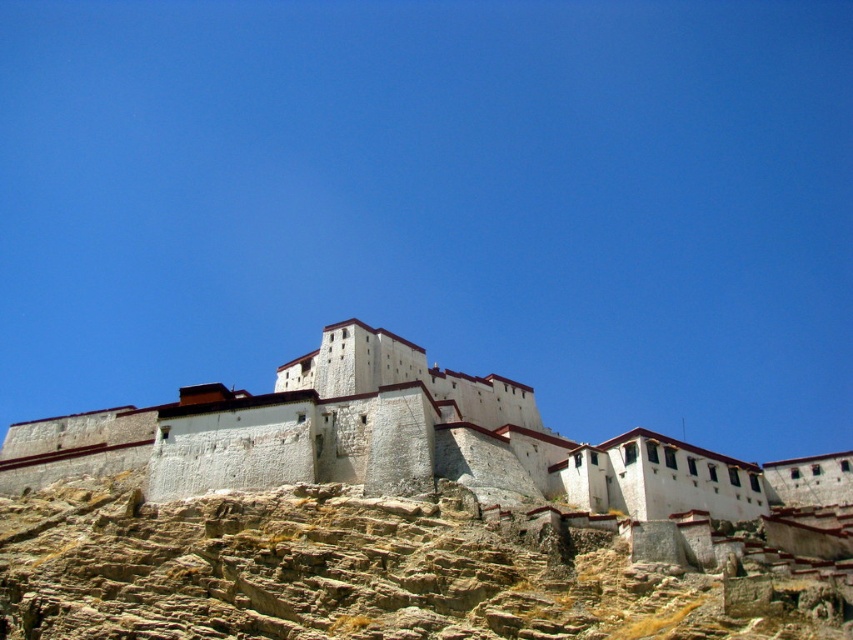
Is point (589, 602) farther from viewer compared to point (277, 451)?

No, it is in front of (277, 451).

Can you confirm if brown rocky hill at lower left is thinner than white stone castle at center?

Correct, brown rocky hill at lower left's width is less than white stone castle at center's.

What are the coordinates of `brown rocky hill at lower left` in the screenshot? It's located at (352, 572).